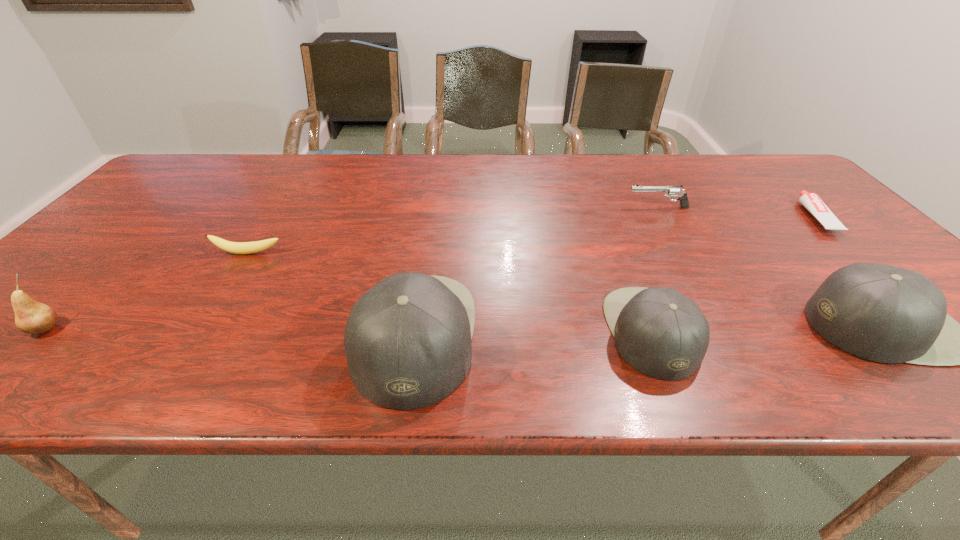
Image resolution: width=960 pixels, height=540 pixels. Identify the location of free space at the near edge of the desktop. (708, 312).

Where is `vacant space at the near left corner`? vacant space at the near left corner is located at coordinates (11, 334).

The image size is (960, 540). I want to click on vacant area at the far right corner of the desktop, so click(781, 169).

Image resolution: width=960 pixels, height=540 pixels. I want to click on vacant area between the pistol and the pear, so click(x=352, y=268).

Identify the location of unoccupied area between the shortest cap and the pistol. (655, 269).

Locate an element on the screen. This screenshot has height=540, width=960. empty space that is in between the pear and the pistol is located at coordinates (352, 268).

Locate an element on the screen. free space between the second cap from right to left and the third shortest object is located at coordinates (655, 269).

The height and width of the screenshot is (540, 960). What are the coordinates of `unoccupied area between the shortest object and the pistol` in the screenshot? It's located at (736, 212).

You are a GUI agent. You are given a task and a screenshot of the screen. Output one action in this format:
    pyautogui.click(x=<x>, y=<y>)
    Task: Click on the free space between the toothpaste and the fifth nearest object
    The height and width of the screenshot is (540, 960).
    Given the screenshot: What is the action you would take?
    pyautogui.click(x=532, y=235)

This screenshot has height=540, width=960. What are the coordinates of `free space between the third object from left to right and the shortest cap` in the screenshot? It's located at (533, 334).